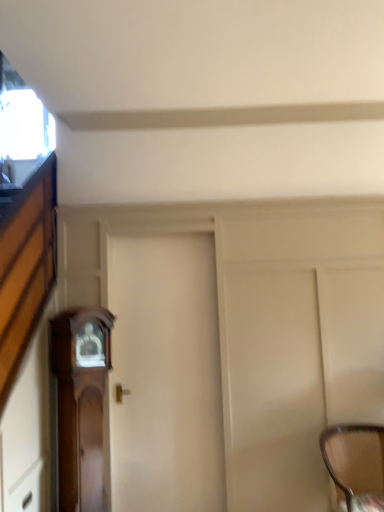
Where is `wooden grandfather clock at left`? wooden grandfather clock at left is located at coordinates (81, 402).

The height and width of the screenshot is (512, 384). Describe the element at coordinates (165, 375) in the screenshot. I see `white matte door at center` at that location.

Image resolution: width=384 pixels, height=512 pixels. Describe the element at coordinates (28, 490) in the screenshot. I see `wooden drawer at lower left` at that location.

The height and width of the screenshot is (512, 384). In order to click on woven fabric chair at lower right in this screenshot , I will do `click(355, 465)`.

From the image's perspective, which one is positioned lower, woven fabric chair at lower right or wooden drawer at lower left?

wooden drawer at lower left, from the image's perspective.

Which is farther, (337, 429) or (16, 481)?

The point (337, 429) is farther.

Do you think woven fabric chair at lower right is within wooden drawer at lower left, or outside of it?

woven fabric chair at lower right is not enclosed by wooden drawer at lower left.

Between woven fabric chair at lower right and wooden drawer at lower left, which one has larger width?

woven fabric chair at lower right.

Would you say white matte door at center is part of wooden grandfather clock at left's contents?

No, white matte door at center is not a part of wooden grandfather clock at left.

In the scene shown: Does wooden grandfather clock at left have a larger size compared to white matte door at center?

Incorrect, wooden grandfather clock at left is not larger than white matte door at center.

Is the depth of wooden grandfather clock at left greater than that of white matte door at center?

No.

Is wooden drawer at lower left surrounding white matte door at center?

No, wooden drawer at lower left does not contain white matte door at center.

In the scene shown: How different are the orientations of wooden drawer at lower left and white matte door at center in degrees?

They differ by 90 degrees in their facing directions.

Between wooden drawer at lower left and white matte door at center, which one is positioned behind?

white matte door at center is further from the camera.

Is wooden drawer at lower left in contact with white matte door at center?

No, wooden drawer at lower left is not with white matte door at center.

Considering the relative sizes of woven fabric chair at lower right and wooden grandfather clock at left in the image provided, is woven fabric chair at lower right wider than wooden grandfather clock at left?

Yes, woven fabric chair at lower right is wider than wooden grandfather clock at left.

You are a GUI agent. You are given a task and a screenshot of the screen. Output one action in this format:
    pyautogui.click(x=<x>, y=<y>)
    Task: Click on the furniture on the left of woven fabric chair at lower right
    
    Given the screenshot: What is the action you would take?
    pyautogui.click(x=81, y=402)

In the scene shown: Is wooden grandfather clock at left a part of woven fabric chair at lower right?

No, wooden grandfather clock at left is not surrounded by woven fabric chair at lower right.

How different are the orientations of woven fabric chair at lower right and wooden grandfather clock at left in degrees?

33.9 degrees separate the facing orientations of woven fabric chair at lower right and wooden grandfather clock at left.

Which object is positioned more to the right, white matte door at center or wooden grandfather clock at left?

white matte door at center.

Does white matte door at center have a lesser height compared to wooden grandfather clock at left?

→ Incorrect, the height of white matte door at center does not fall short of that of wooden grandfather clock at left.

Are white matte door at center and wooden grandfather clock at left making contact?

No, white matte door at center is not next to wooden grandfather clock at left.

Looking at this image, in terms of width, does white matte door at center look wider or thinner when compared to wooden drawer at lower left?

Considering their sizes, white matte door at center looks broader than wooden drawer at lower left.

Which point is more forward, (165, 467) or (22, 499)?

The point (22, 499) is more forward.

How many degrees apart are the facing directions of white matte door at center and wooden drawer at lower left?

There is a 90-degree angle between the facing directions of white matte door at center and wooden drawer at lower left.

Is white matte door at center behind wooden drawer at lower left?

Yes, the depth of white matte door at center is greater than that of wooden drawer at lower left.

Is there a large distance between wooden drawer at lower left and wooden grandfather clock at left?

That's not correct — wooden drawer at lower left is a little close to wooden grandfather clock at left.

From a real-world perspective, is wooden drawer at lower left positioned above or below wooden grandfather clock at left?

wooden drawer at lower left is below wooden grandfather clock at left.

Between wooden drawer at lower left and wooden grandfather clock at left, which one has larger size?

Bigger between the two is wooden grandfather clock at left.

Find the location of a particular element. This screenshot has width=384, height=512. drawer in front of the wooden grandfather clock at left is located at coordinates (28, 490).

In the image, there is a woven fabric chair at lower right. Where is `drawer below it (from the image's perspective)`? drawer below it (from the image's perspective) is located at coordinates (28, 490).

I want to click on furniture on the left of white matte door at center, so click(x=81, y=402).

Based on the photo, which object lies further to the anchor point wooden drawer at lower left, white matte door at center or woven fabric chair at lower right?

woven fabric chair at lower right lies further to wooden drawer at lower left than the other object.

Looking at the image, which one is located closer to wooden drawer at lower left, woven fabric chair at lower right or white matte door at center?

The object closer to wooden drawer at lower left is white matte door at center.

Considering their positions, is wooden drawer at lower left positioned further to wooden grandfather clock at left than woven fabric chair at lower right?

The object further to wooden grandfather clock at left is woven fabric chair at lower right.

Based on their spatial positions, is white matte door at center or woven fabric chair at lower right further from wooden grandfather clock at left?

woven fabric chair at lower right is further to wooden grandfather clock at left.

From the image, which object appears to be nearer to woven fabric chair at lower right, white matte door at center or wooden drawer at lower left?

white matte door at center lies closer to woven fabric chair at lower right than the other object.

In the scene shown: Based on their spatial positions, is woven fabric chair at lower right or white matte door at center closer to wooden grandfather clock at left?

Based on the image, white matte door at center appears to be nearer to wooden grandfather clock at left.

Estimate the real-world distances between objects in this image. Which object is closer to white matte door at center, woven fabric chair at lower right or wooden drawer at lower left?

wooden drawer at lower left is positioned closer to the anchor white matte door at center.

From the image, which object appears to be farther from wooden drawer at lower left, wooden grandfather clock at left or woven fabric chair at lower right?

The object further to wooden drawer at lower left is woven fabric chair at lower right.

Find the location of a particular element. The width and height of the screenshot is (384, 512). furniture between wooden drawer at lower left and woven fabric chair at lower right is located at coordinates (81, 402).

This screenshot has width=384, height=512. What are the coordinates of `door between wooden drawer at lower left and woven fabric chair at lower right` in the screenshot? It's located at (165, 375).

The height and width of the screenshot is (512, 384). I want to click on furniture located between wooden drawer at lower left and white matte door at center in the depth direction, so click(x=81, y=402).

Find the location of a particular element. The image size is (384, 512). door between wooden grandfather clock at left and woven fabric chair at lower right from left to right is located at coordinates (165, 375).